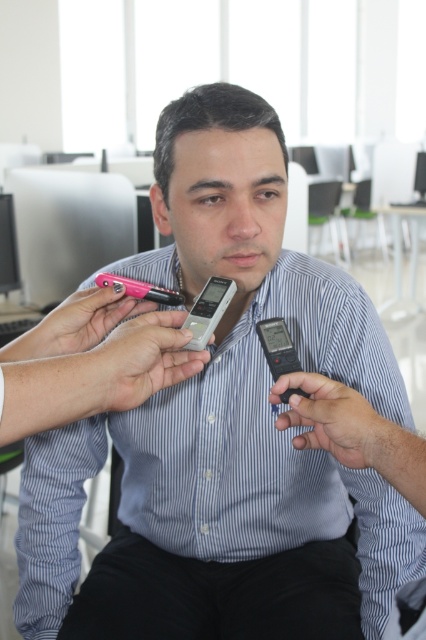
You are a photographer standing 1 meter away from the camera in the scene. You want to adjust the focus to capture the point at coordinates point (259, 321). Since the camera is already focused at 73.05 centimeters, will you need to move closer or farther away to focus on the point?

The point (259, 321) is 73.05 centimeters away from the camera. Since you are currently standing 1 meter away, which is farther than 73.05 centimeters, you need to move closer to the point to adjust the focus properly.

You are a photographer adjusting your camera settings to capture a closeup of the black cotton pants at lower center. The camera has a depth of field that can focus clearly up to 28 inches. Will the pants be in focus?

The black cotton pants at lower center is 28.20 inches from the camera. Since the depth of field can focus up to 28 inches, the pants are slightly beyond the focus range and may not be in clear focus.

You are a photographer setting up a shoot. You need to position two smartphones, the silver metallic smartphone at center and the pink plastic smartphone at center, in a way that aligns with their current arrangement. Which smartphone should you place lower to maintain the setup?

The silver metallic smartphone at center should be placed lower since it is positioned below the pink plastic smartphone at center in the current setup.